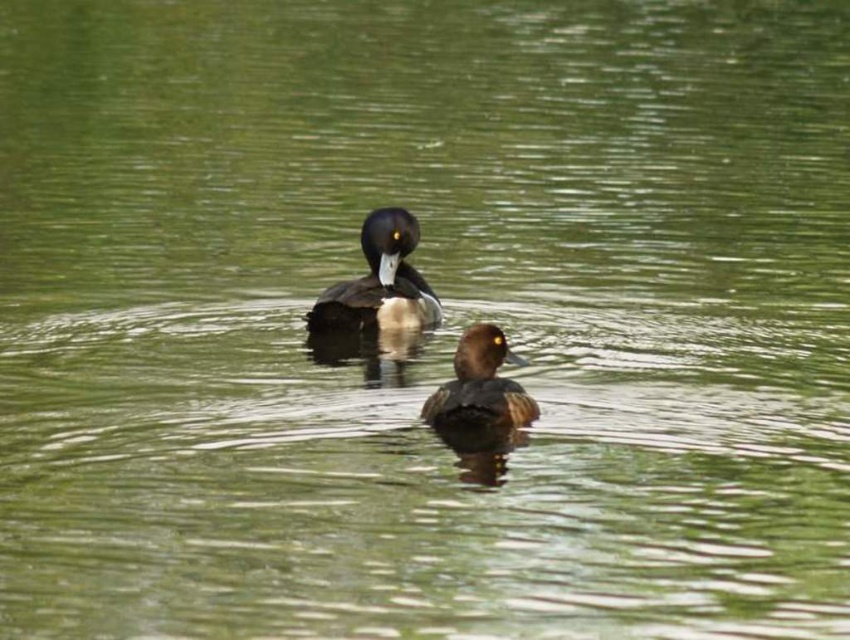
Consider the image. You are observing two ducks in the water. The shiny black duck at center and the brown fuzzy duck at center. Which duck is positioned higher in the image?

The shiny black duck at center is positioned higher in the image than the brown fuzzy duck at center.